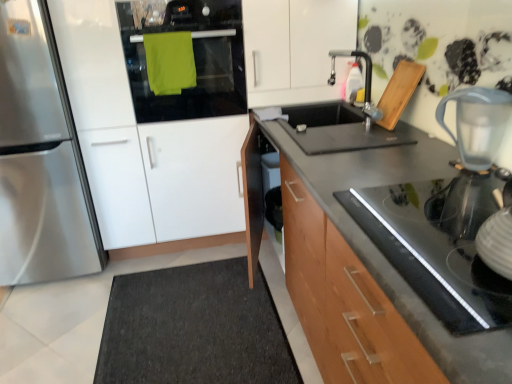
Find the location of a particular element. satin silver refrigerator at left is located at coordinates (40, 158).

What do you see at coordinates (142, 143) in the screenshot? The width and height of the screenshot is (512, 384). I see `wooden cabinet at center` at bounding box center [142, 143].

What do you see at coordinates (365, 83) in the screenshot? I see `metallic faucet at upper right` at bounding box center [365, 83].

In order to face black glass cooktop at lower right, should I rotate leftwards or rightwards?

To align with it, rotate right about 22.919°.

Describe the element at coordinates (477, 123) in the screenshot. This screenshot has height=384, width=512. I see `transparent plastic pitcher at upper right` at that location.

At what (x,y) coordinates should I click in order to perform the action: click on satin silver refrigerator at left. Please return your answer as a coordinate pair (x, y). Looking at the image, I should click on (40, 158).

How many degrees apart are the facing directions of wooden cabinet at center and black glass cooktop at lower right?

The angular difference between wooden cabinet at center and black glass cooktop at lower right is 90 degrees.

Is wooden cabinet at center positioned with its back to black glass cooktop at lower right?

That's not correct — wooden cabinet at center is not looking away from black glass cooktop at lower right.

From the image's perspective, is wooden cabinet at center located above black glass cooktop at lower right?

Yes, from the image's perspective, wooden cabinet at center is above black glass cooktop at lower right.

Does satin silver refrigerator at left touch transparent plastic pitcher at upper right?

No, satin silver refrigerator at left is not in contact with transparent plastic pitcher at upper right.

Could you tell me if satin silver refrigerator at left is facing transparent plastic pitcher at upper right?

No, satin silver refrigerator at left is not turned towards transparent plastic pitcher at upper right.

Is satin silver refrigerator at left smaller than transparent plastic pitcher at upper right?

Actually, satin silver refrigerator at left might be larger than transparent plastic pitcher at upper right.

From the picture: From the image's perspective, is dark gray carpet at lower left over green matte oven at upper left?

Incorrect, from the image's perspective, dark gray carpet at lower left is lower than green matte oven at upper left.

Do you think dark gray carpet at lower left is within green matte oven at upper left, or outside of it?

dark gray carpet at lower left exists outside the volume of green matte oven at upper left.

Which is nearer, [167,379] or [242,92]?

Point [167,379] appears to be closer to the viewer than point [242,92].

Is dark gray carpet at lower left smaller than green matte oven at upper left?

No.

From the picture: How much distance is there between satin silver refrigerator at left and dark gray carpet at lower left?

The distance of satin silver refrigerator at left from dark gray carpet at lower left is 30.97 inches.

Does satin silver refrigerator at left have a greater width compared to dark gray carpet at lower left?

No, satin silver refrigerator at left is not wider than dark gray carpet at lower left.

From a real-world perspective, is satin silver refrigerator at left above or below dark gray carpet at lower left?

From a real-world perspective, satin silver refrigerator at left is physically above dark gray carpet at lower left.

Locate an element on the screen. This screenshot has width=512, height=384. doormat below the satin silver refrigerator at left (from a real-world perspective) is located at coordinates (194, 328).

In terms of height, does metallic faucet at upper right look taller or shorter compared to transparent plastic pitcher at upper right?

Clearly, metallic faucet at upper right is taller compared to transparent plastic pitcher at upper right.

From the image's perspective, is metallic faucet at upper right beneath transparent plastic pitcher at upper right?

Actually, metallic faucet at upper right appears above transparent plastic pitcher at upper right in the image.

Is metallic faucet at upper right outside of transparent plastic pitcher at upper right?

Absolutely, metallic faucet at upper right is external to transparent plastic pitcher at upper right.

Looking at their sizes, would you say metallic faucet at upper right is wider or thinner than transparent plastic pitcher at upper right?

Considering their sizes, metallic faucet at upper right looks slimmer than transparent plastic pitcher at upper right.

From the image's perspective, which is above, satin silver refrigerator at left or metallic faucet at upper right?

metallic faucet at upper right is shown above in the image.

Based on the photo, considering the positions of objects satin silver refrigerator at left and metallic faucet at upper right in the image provided, who is behind, satin silver refrigerator at left or metallic faucet at upper right?

satin silver refrigerator at left is further from the camera.

Identify the location of faucet on the right of satin silver refrigerator at left. (365, 83).

Which of these two, satin silver refrigerator at left or metallic faucet at upper right, stands shorter?

metallic faucet at upper right.

Is green matte oven at upper left positioned beyond the bounds of black glass cooktop at lower right?

Yes, green matte oven at upper left is located beyond the bounds of black glass cooktop at lower right.

In the scene shown: Who is shorter, green matte oven at upper left or black glass cooktop at lower right?

black glass cooktop at lower right is shorter.

Is green matte oven at upper left positioned behind black glass cooktop at lower right?

Yes, green matte oven at upper left is further from the viewer.

Is green matte oven at upper left next to black glass cooktop at lower right and touching it?

No, green matte oven at upper left is not next to black glass cooktop at lower right.

Identify the location of cabinetry located above the black glass cooktop at lower right (from the image's perspective). (142, 143).

Identify the location of kitchen appliance on the right of satin silver refrigerator at left. This screenshot has height=384, width=512. (477, 123).

When comparing their distances from transparent plastic pitcher at upper right, does satin silver refrigerator at left or dark gray carpet at lower left seem further?

satin silver refrigerator at left is positioned further to the anchor transparent plastic pitcher at upper right.

Based on their spatial positions, is green matte oven at upper left or metallic faucet at upper right further from wooden cabinet at center?

The object further to wooden cabinet at center is metallic faucet at upper right.

Looking at the image, which one is located further to green matte oven at upper left, satin silver refrigerator at left or wooden cabinet at center?

satin silver refrigerator at left is positioned further to the anchor green matte oven at upper left.

Considering their positions, is dark gray carpet at lower left positioned closer to satin silver refrigerator at left than black glass cooktop at lower right?

Among the two, dark gray carpet at lower left is located nearer to satin silver refrigerator at left.

Which object lies further to the anchor point satin silver refrigerator at left, wooden cabinet at center or green matte oven at upper left?

green matte oven at upper left lies further to satin silver refrigerator at left than the other object.

Based on their spatial positions, is transparent plastic pitcher at upper right or black glass cooktop at lower right closer to satin silver refrigerator at left?

black glass cooktop at lower right.

Estimate the real-world distances between objects in this image. Which object is further from metallic faucet at upper right, wooden cabinet at center or transparent plastic pitcher at upper right?

wooden cabinet at center is further to metallic faucet at upper right.

Based on the photo, from the image, which object appears to be nearer to wooden cabinet at center, dark gray carpet at lower left or transparent plastic pitcher at upper right?

dark gray carpet at lower left is closer to wooden cabinet at center.

The image size is (512, 384). Identify the location of faucet between satin silver refrigerator at left and transparent plastic pitcher at upper right. (365, 83).

Identify the location of kitchen appliance located between black glass cooktop at lower right and green matte oven at upper left in the depth direction. The image size is (512, 384). (477, 123).

Where is `oven between wooden cabinet at center and metallic faucet at upper right from left to right`? This screenshot has height=384, width=512. oven between wooden cabinet at center and metallic faucet at upper right from left to right is located at coordinates (194, 58).

This screenshot has width=512, height=384. Identify the location of oven situated between satin silver refrigerator at left and metallic faucet at upper right from left to right. (194, 58).